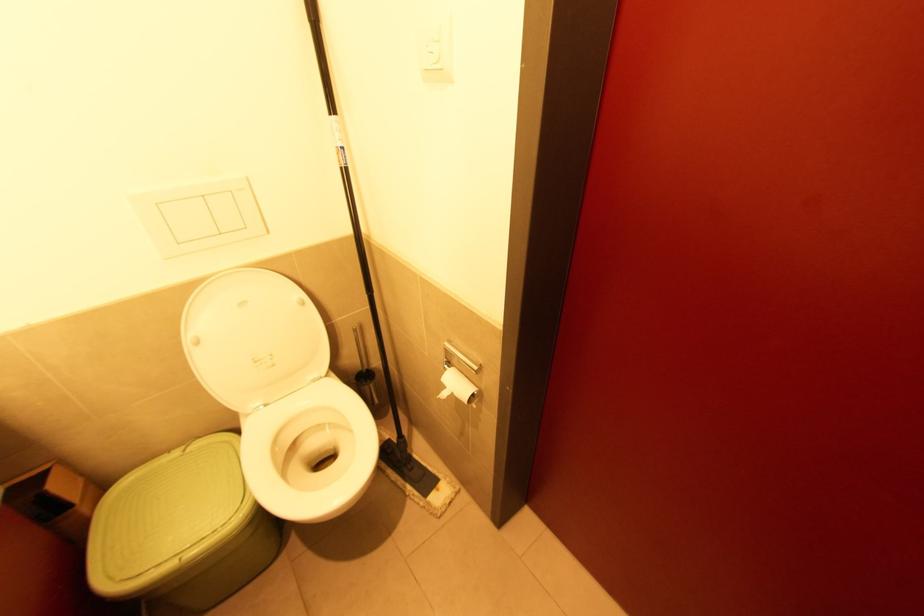
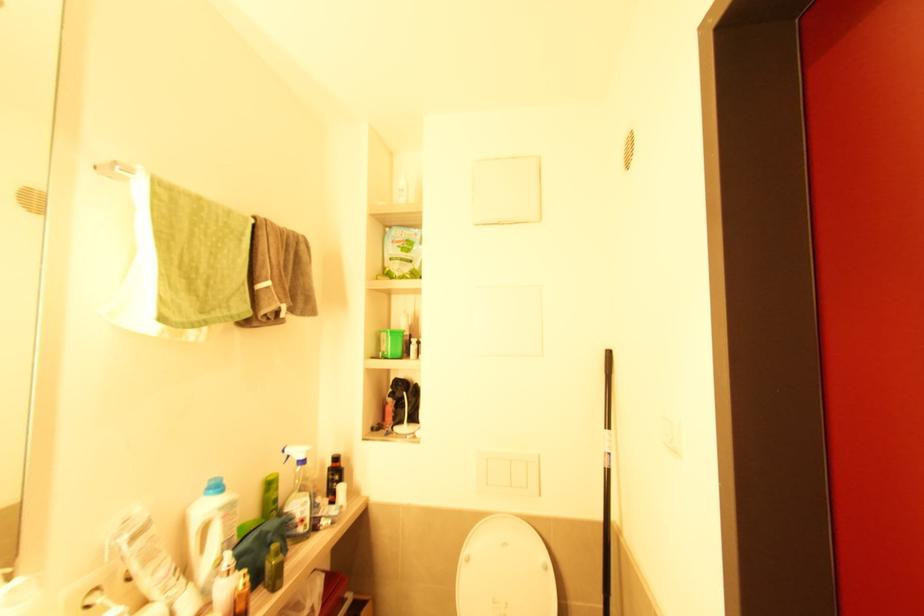
Locate, in the second image, the point that corresponds to pixel 347 172 in the first image.

(610, 472)